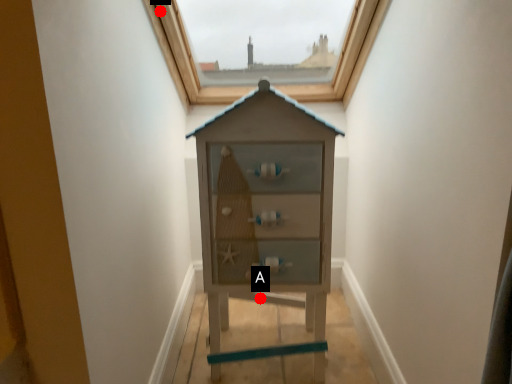
Question: Two points are circled on the image, labeled by A and B beside each circle. Which point is closer to the camera?

Choices:
 (A) A is closer
 (B) B is closer

Answer: (B)